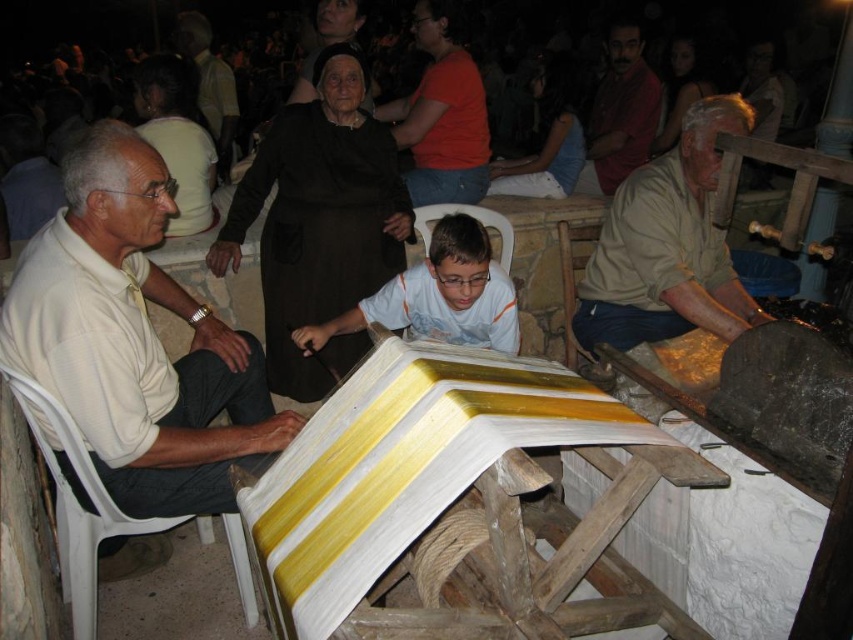
You are a photographer at the event and want to capture a photo that includes both the white plastic chair at lower left and the dark red shirt at upper right. Based on their positions, which object should you focus on first to ensure both are in frame?

The white plastic chair at lower left is located below dark red shirt at upper right. To ensure both are in frame, focus on the white plastic chair at lower left first as it is lower in the image, then adjust the camera angle upwards to include the dark red shirt at upper right.

In the scene shown: You are standing in the scene and want to sit down. There is a white plastic chair at lower left and a dark red shirt at upper right. Which object is closer to you?

The white plastic chair at lower left is closer to you than the dark red shirt at upper right.